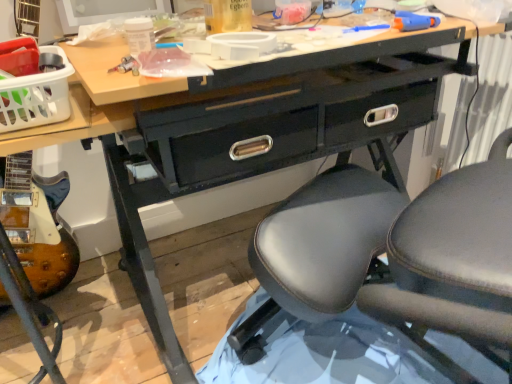
Question: Does black leather chair at center come in front of wooden electric guitar at lower left?

Choices:
 (A) yes
 (B) no

Answer: (A)

Question: Considering the relative sizes of black leather chair at center and wooden electric guitar at lower left in the image provided, is black leather chair at center shorter than wooden electric guitar at lower left?

Choices:
 (A) yes
 (B) no

Answer: (B)

Question: Is wooden electric guitar at lower left a part of black leather chair at center?

Choices:
 (A) yes
 (B) no

Answer: (B)

Question: From a real-world perspective, is black leather chair at center beneath wooden electric guitar at lower left?

Choices:
 (A) yes
 (B) no

Answer: (B)

Question: From the image's perspective, is black leather chair at center above wooden electric guitar at lower left?

Choices:
 (A) no
 (B) yes

Answer: (B)

Question: Is white plastic basket at upper left wider or thinner than wooden electric guitar at lower left?

Choices:
 (A) thin
 (B) wide

Answer: (A)

Question: Based on their positions, is white plastic basket at upper left located to the left or right of wooden electric guitar at lower left?

Choices:
 (A) right
 (B) left

Answer: (A)

Question: Is white plastic basket at upper left in front of or behind wooden electric guitar at lower left in the image?

Choices:
 (A) front
 (B) behind

Answer: (B)

Question: From the image's perspective, relative to wooden electric guitar at lower left, is white plastic basket at upper left above or below?

Choices:
 (A) above
 (B) below

Answer: (A)

Question: Is black leather chair at center in front of or behind white plastic basket at upper left in the image?

Choices:
 (A) behind
 (B) front

Answer: (B)

Question: Looking at their shapes, would you say black leather chair at center is wider or thinner than white plastic basket at upper left?

Choices:
 (A) wide
 (B) thin

Answer: (A)

Question: Considering the positions of black leather chair at center and white plastic basket at upper left in the image, is black leather chair at center bigger or smaller than white plastic basket at upper left?

Choices:
 (A) small
 (B) big

Answer: (B)

Question: Do you think black leather chair at center is within white plastic basket at upper left, or outside of it?

Choices:
 (A) inside
 (B) outside

Answer: (B)

Question: From the image's perspective, relative to wooden electric guitar at lower left, is black leather chair at center above or below?

Choices:
 (A) below
 (B) above

Answer: (B)

Question: Based on their sizes in the image, would you say black leather chair at center is bigger or smaller than wooden electric guitar at lower left?

Choices:
 (A) big
 (B) small

Answer: (A)